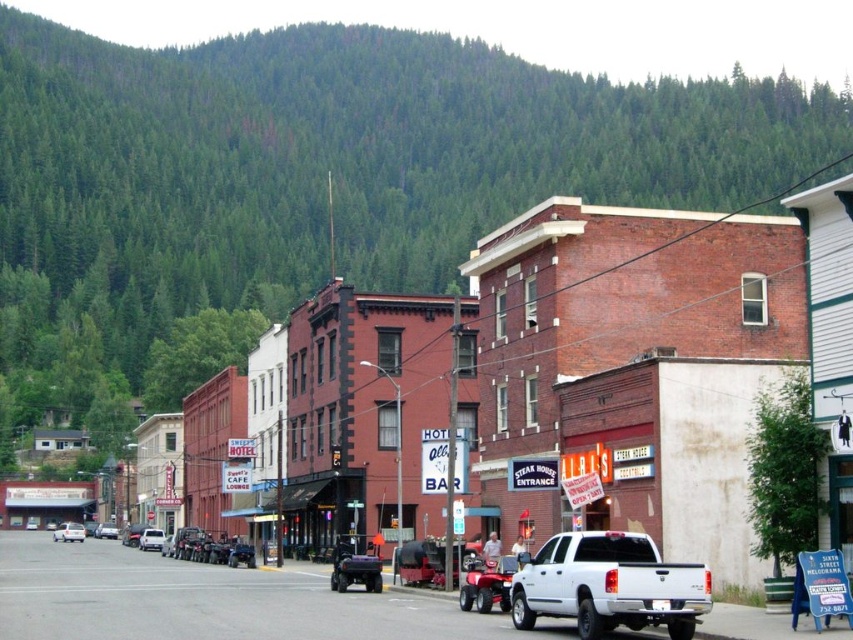
Question: Is white matte van at center further to the viewer compared to silver metallic sedan at center?

Choices:
 (A) yes
 (B) no

Answer: (B)

Question: From the image, what is the correct spatial relationship of white matte car at center in relation to silver metallic sedan at center?

Choices:
 (A) right
 (B) left

Answer: (B)

Question: Is white matte car at center positioned in front of silver metallic sedan at center?

Choices:
 (A) yes
 (B) no

Answer: (A)

Question: Which of the following is the farthest from the observer?

Choices:
 (A) (115, 532)
 (B) (614, 573)
 (C) (78, 529)
 (D) (306, 435)

Answer: (A)

Question: Which of the following is the farthest from the observer?

Choices:
 (A) (158, 541)
 (B) (53, 540)
 (C) (115, 525)
 (D) (738, 221)

Answer: (C)

Question: Estimate the real-world distances between objects in this image. Which object is closer to the white matte pickup truck at center?

Choices:
 (A) white matte car at center
 (B) silver metallic sedan at center

Answer: (A)